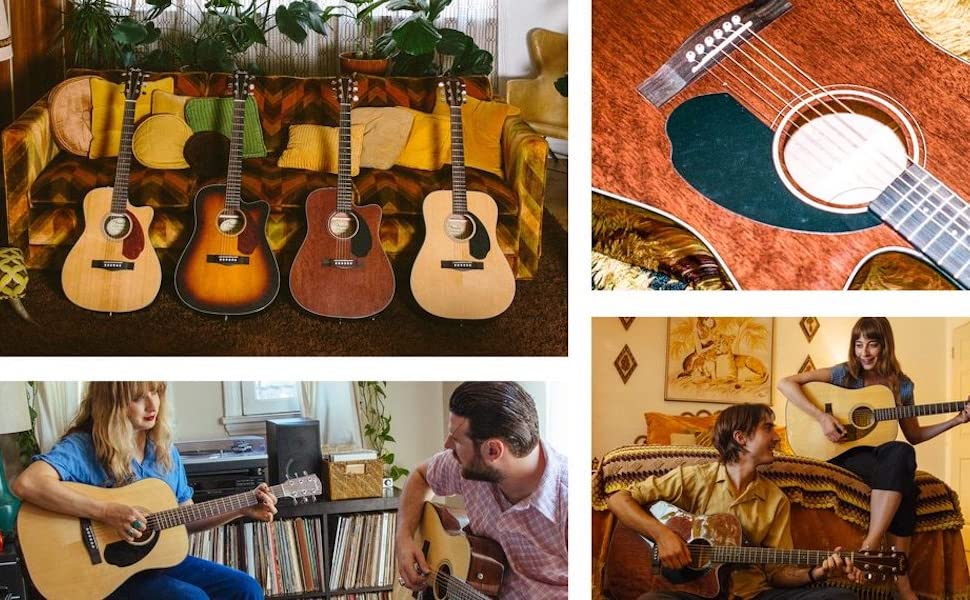
Identify the location of gold or yellow colored pillows. This screenshot has height=600, width=970. (102, 106), (162, 102), (160, 142), (318, 142), (440, 134), (487, 135), (388, 141), (784, 445), (683, 438).